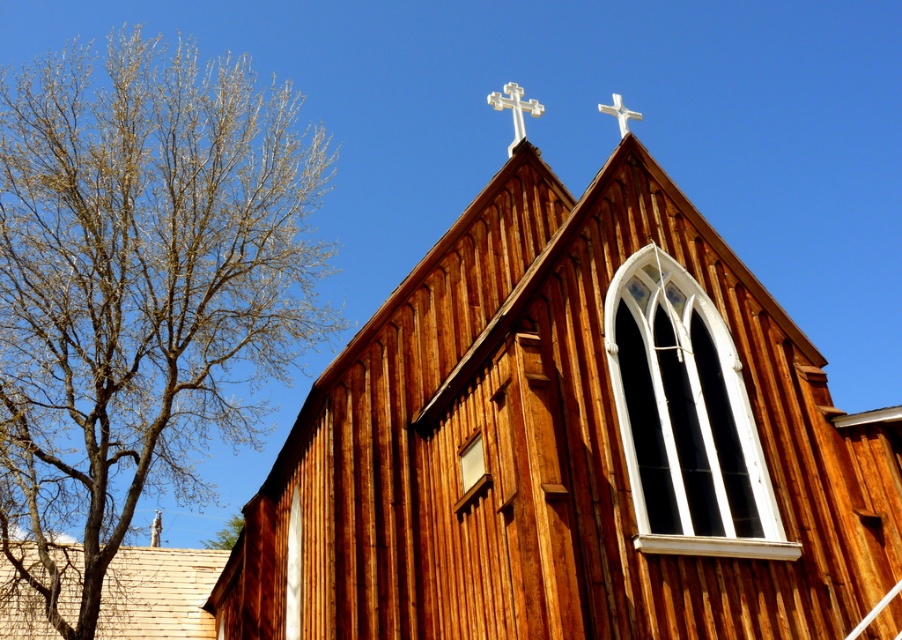
Question: Is wooden chapel at upper center to the left of silver metallic cross at upper center from the viewer's perspective?

Choices:
 (A) no
 (B) yes

Answer: (B)

Question: Considering the real-world distances, which object is closest to the silver metallic cross at upper center?

Choices:
 (A) bare wood tree at left
 (B) white wooden cross at upper center
 (C) wooden chapel at upper center

Answer: (B)

Question: Which of the following is the closest to the observer?

Choices:
 (A) (615, 93)
 (B) (530, 109)

Answer: (B)

Question: Is wooden chapel at upper center smaller than bare wood tree at left?

Choices:
 (A) no
 (B) yes

Answer: (B)

Question: Which point is closer to the camera?

Choices:
 (A) (614, 115)
 (B) (131, 120)
 (C) (505, 104)
 (D) (575, 212)

Answer: (D)

Question: Can you confirm if bare wood tree at left is bigger than white wooden cross at upper center?

Choices:
 (A) yes
 (B) no

Answer: (A)